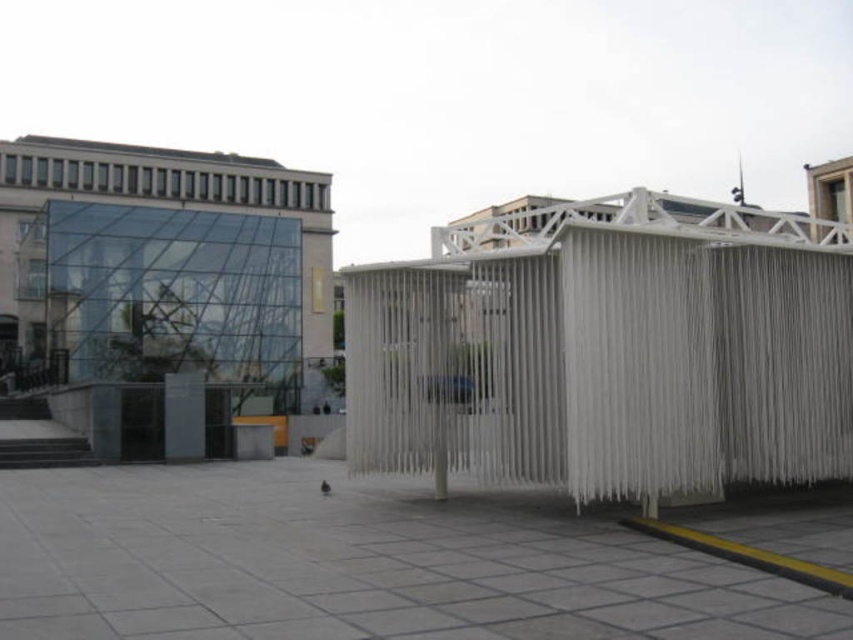
In the scene shown: Between white woven structure at center and transparent glass building at upper left, which one is positioned lower?

Positioned lower is transparent glass building at upper left.

Which of these two, white woven structure at center or transparent glass building at upper left, stands shorter?

white woven structure at center is shorter.

Locate an element on the screen. white woven structure at center is located at coordinates (608, 349).

What are the coordinates of `white woven structure at center` in the screenshot? It's located at (608, 349).